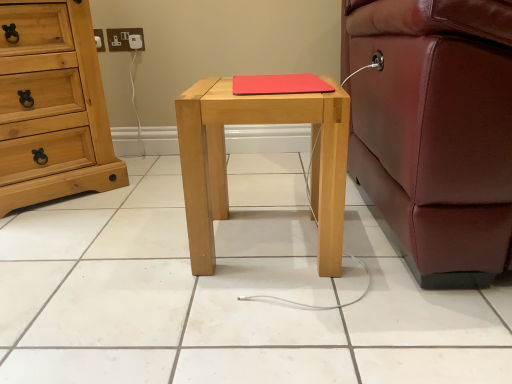
Identify the location of free space in front of light brown wooden chest of drawers at left. (62, 229).